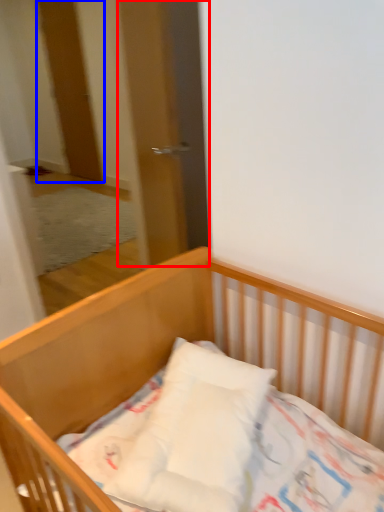
Question: Which object appears closest to the camera in this image, screen door (highlighted by a red box) or door (highlighted by a blue box)?

Choices:
 (A) screen door
 (B) door

Answer: (A)